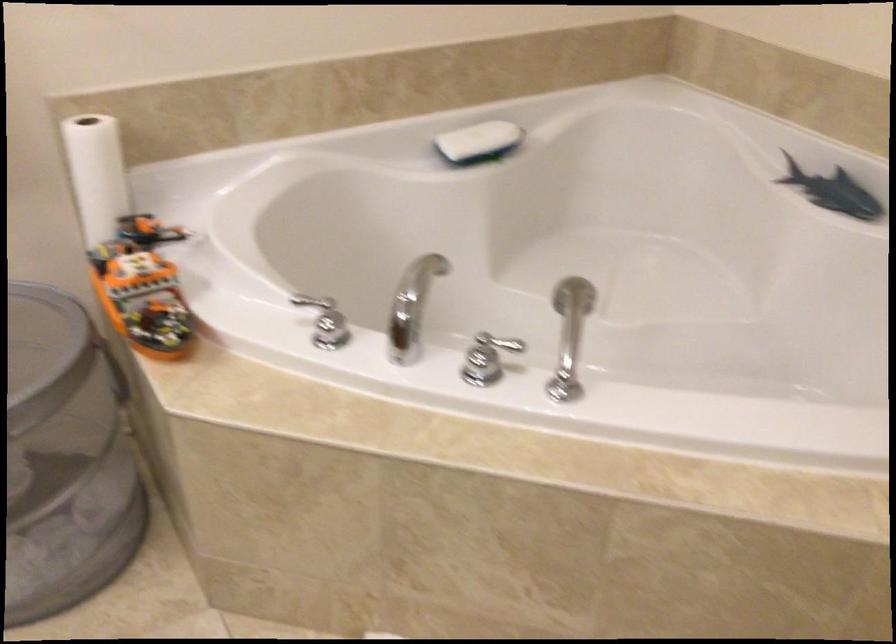
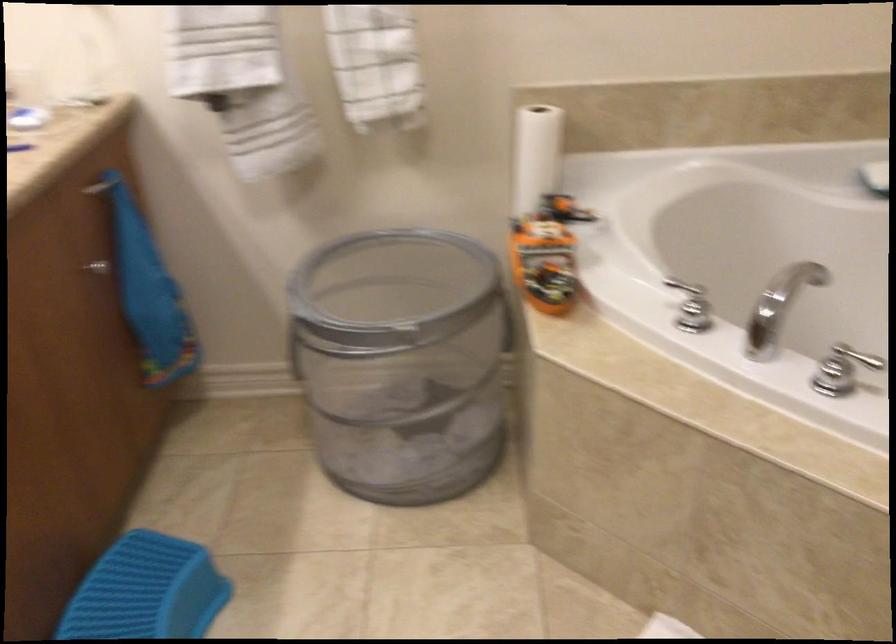
Find the pixel in the second image that matches point 104,178 in the first image.

(536, 156)